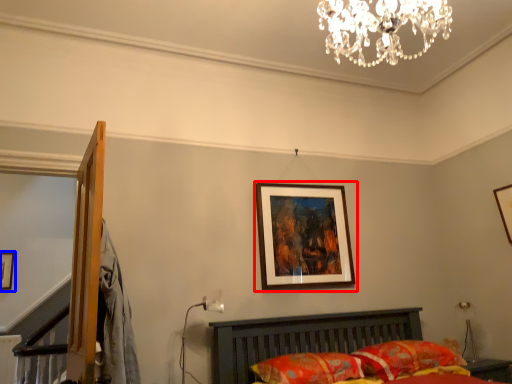
Question: Which object appears closest to the camera in this image, picture frame (highlighted by a red box) or picture frame (highlighted by a blue box)?

Choices:
 (A) picture frame
 (B) picture frame

Answer: (A)